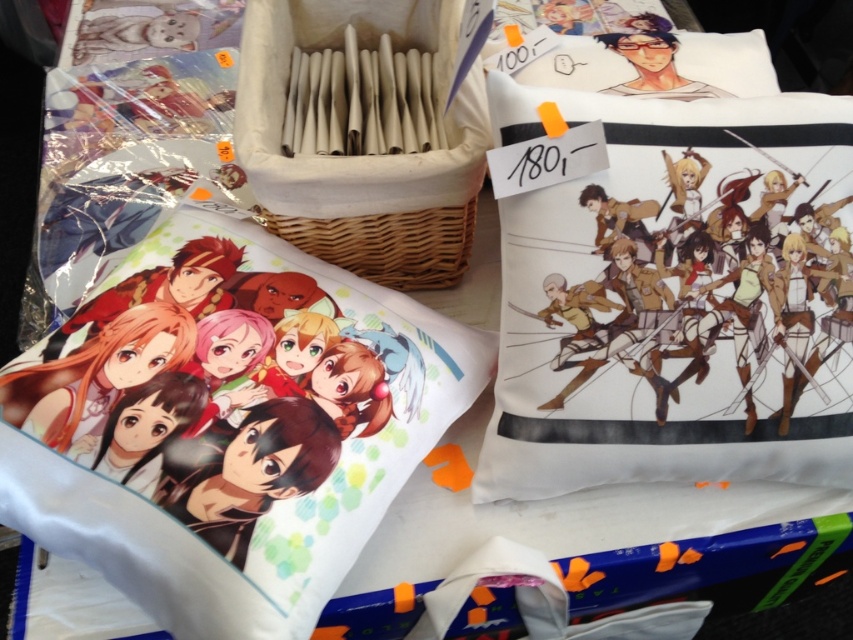
Question: Which point is farther to the camera?

Choices:
 (A) woven wood basket at center
 (B) matte white pillow with anime characters at center

Answer: (A)

Question: Which point is closer to the camera?

Choices:
 (A) (260, 161)
 (B) (793, 476)

Answer: (A)

Question: Is white cotton pillow at right further to camera compared to matte white pillow with anime characters at center?

Choices:
 (A) no
 (B) yes

Answer: (B)

Question: Is white cotton pillow at right positioned in front of matte white pillow with anime characters at center?

Choices:
 (A) no
 (B) yes

Answer: (A)

Question: From the image, what is the correct spatial relationship of white cotton pillow at right in relation to woven wood basket at center?

Choices:
 (A) above
 (B) below

Answer: (B)

Question: Which of the following is the closest to the observer?

Choices:
 (A) matte white pillow with anime characters at center
 (B) woven wood basket at center
 (C) white cotton pillow at right

Answer: (A)